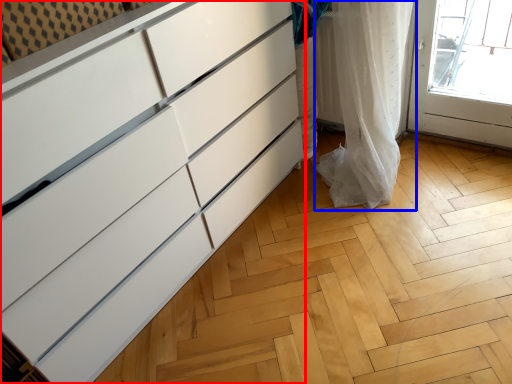
Question: Among these objects, which one is nearest to the camera, chest of drawers (highlighted by a red box) or curtain (highlighted by a blue box)?

Choices:
 (A) chest of drawers
 (B) curtain

Answer: (A)